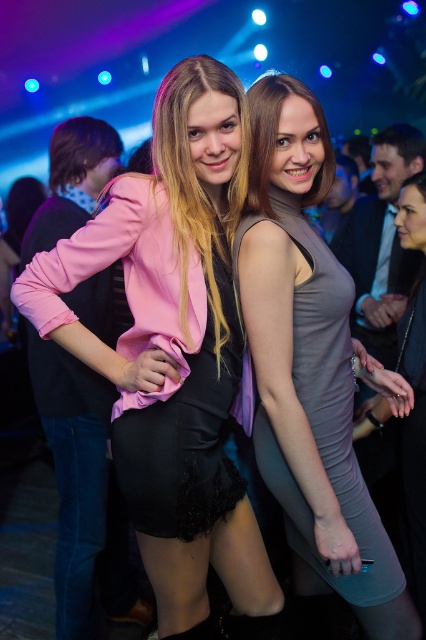
Question: Is the position of pink satin dress at center less distant than that of satin gray dress at center?

Choices:
 (A) yes
 (B) no

Answer: (A)

Question: In this image, where is pink satin dress at center located relative to satin gray dress at center?

Choices:
 (A) below
 (B) above

Answer: (A)

Question: Does pink satin dress at center appear under satin gray dress at center?

Choices:
 (A) no
 (B) yes

Answer: (B)

Question: Which point appears farthest from the camera in this image?

Choices:
 (A) (222, 262)
 (B) (259, 308)

Answer: (A)